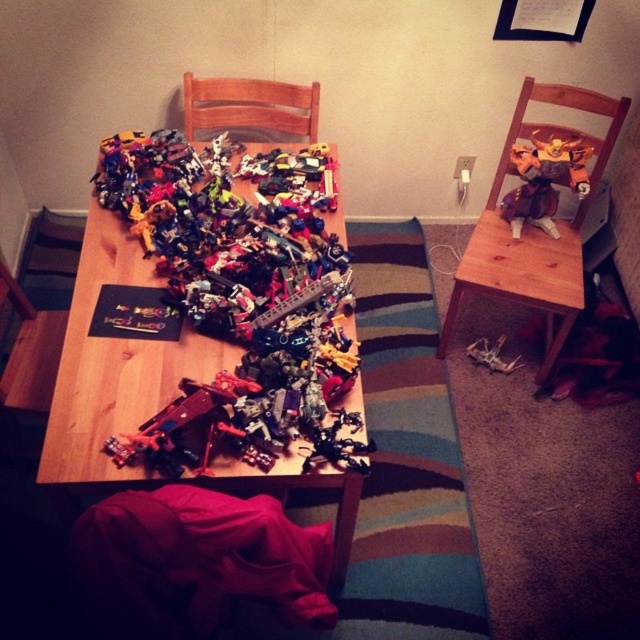
Question: Is wooden chair at right wider than wooden chair at upper center?

Choices:
 (A) no
 (B) yes

Answer: (A)

Question: Is wooden table at center thinner than wooden chair at upper center?

Choices:
 (A) no
 (B) yes

Answer: (A)

Question: Which object appears farthest from the camera in this image?

Choices:
 (A) wooden table at center
 (B) shiny metallic robot at upper right
 (C) wooden chair at upper center
 (D) wooden chair at right

Answer: (C)

Question: Considering the real-world distances, which object is closest to the shiny metallic robot at upper right?

Choices:
 (A) wooden chair at upper center
 (B) wooden table at center
 (C) wooden chair at right

Answer: (C)

Question: Which object is the closest to the wooden table at center?

Choices:
 (A) shiny metallic robot at upper right
 (B) wooden chair at right
 (C) wooden chair at upper center

Answer: (C)

Question: Is wooden table at center wider than wooden chair at right?

Choices:
 (A) yes
 (B) no

Answer: (A)